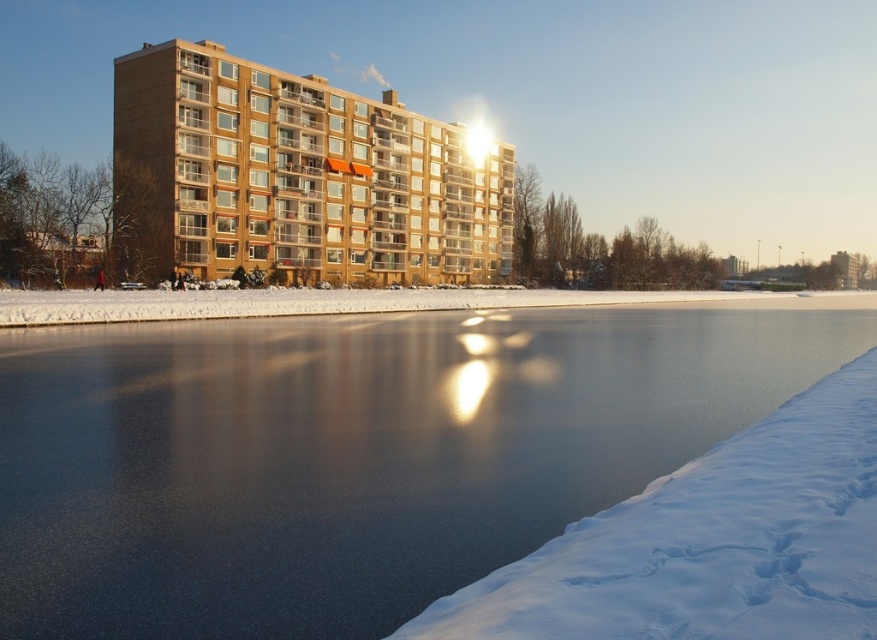
Question: From the image, what is the correct spatial relationship of brown glass building at center in relation to white powdery snow at lower right?

Choices:
 (A) right
 (B) left

Answer: (B)

Question: Does smooth ice at lower center appear over white powdery snow at lower right?

Choices:
 (A) yes
 (B) no

Answer: (A)

Question: Can you confirm if smooth ice at lower center is bigger than white powdery snow at lower right?

Choices:
 (A) yes
 (B) no

Answer: (A)

Question: Which of the following is the closest to the observer?

Choices:
 (A) (422, 428)
 (B) (611, 611)
 (C) (191, 250)

Answer: (B)

Question: Among these points, which one is farthest from the camera?

Choices:
 (A) (264, 122)
 (B) (628, 536)

Answer: (A)

Question: Which of the following is the closest to the observer?

Choices:
 (A) smooth ice at lower center
 (B) brown glass building at center

Answer: (A)